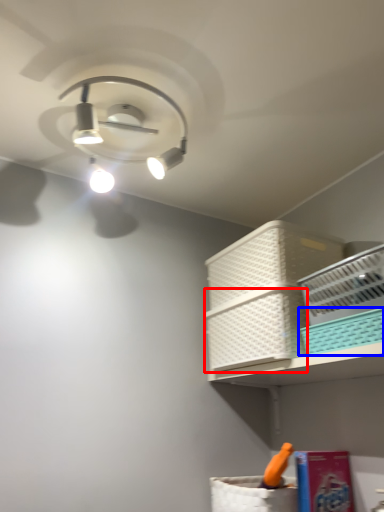
Question: Which of the following is the farthest to the observer, basket (highlighted by a red box) or basket (highlighted by a blue box)?

Choices:
 (A) basket
 (B) basket

Answer: (A)